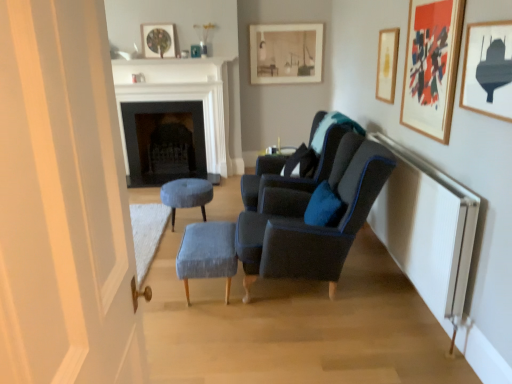
Question: Is matte black submarine at upper right, acting as the fifth picture frame starting from the back, at the left side of matte black picture frame at upper center, which is the 2th picture frame in back-to-front order?

Choices:
 (A) no
 (B) yes

Answer: (A)

Question: Is matte black submarine at upper right, the 1th picture frame viewed from the front, taller than matte black picture frame at upper center, which appears as the 1th picture frame when viewed from the left?

Choices:
 (A) yes
 (B) no

Answer: (A)

Question: From the image's perspective, is matte black submarine at upper right, which is the 5th picture frame from left to right, on matte black picture frame at upper center, which ranks as the fourth picture frame in front-to-back order?

Choices:
 (A) no
 (B) yes

Answer: (A)

Question: Is matte black submarine at upper right, which is the 5th picture frame from left to right, not close to matte black picture frame at upper center, which ranks as the fourth picture frame in front-to-back order?

Choices:
 (A) yes
 (B) no

Answer: (A)

Question: Is matte black picture frame at upper center, the 5th picture frame from the right, inside matte black submarine at upper right, acting as the fifth picture frame starting from the back?

Choices:
 (A) no
 (B) yes

Answer: (A)

Question: Can you confirm if matte black submarine at upper right, which is the 5th picture frame from left to right, is thinner than matte black picture frame at upper center, the 5th picture frame from the right?

Choices:
 (A) no
 (B) yes

Answer: (B)

Question: Is white marble fireplace at center, the 2th fireplace in the back-to-front sequence, at the right side of white fabric curtain at left?

Choices:
 (A) no
 (B) yes

Answer: (A)

Question: From the image's perspective, is white marble fireplace at center, which appears as the 1th fireplace when viewed from the front, located beneath white fabric curtain at left?

Choices:
 (A) no
 (B) yes

Answer: (A)

Question: Is white marble fireplace at center, the 2th fireplace in the back-to-front sequence, directly adjacent to white fabric curtain at left?

Choices:
 (A) no
 (B) yes

Answer: (A)

Question: From the image's perspective, does white marble fireplace at center, which appears as the 1th fireplace when viewed from the front, appear higher than white fabric curtain at left?

Choices:
 (A) yes
 (B) no

Answer: (A)

Question: Can you confirm if white marble fireplace at center, the 2th fireplace in the back-to-front sequence, is shorter than white fabric curtain at left?

Choices:
 (A) yes
 (B) no

Answer: (A)

Question: Is white marble fireplace at center, the 2th fireplace in the back-to-front sequence, located outside white fabric curtain at left?

Choices:
 (A) no
 (B) yes

Answer: (B)

Question: Would you say velvet grey stool at center, arranged as the first stool when viewed from the back, is part of dark gray stone fireplace at center, which appears as the 1th fireplace when viewed from the back,'s contents?

Choices:
 (A) yes
 (B) no

Answer: (B)